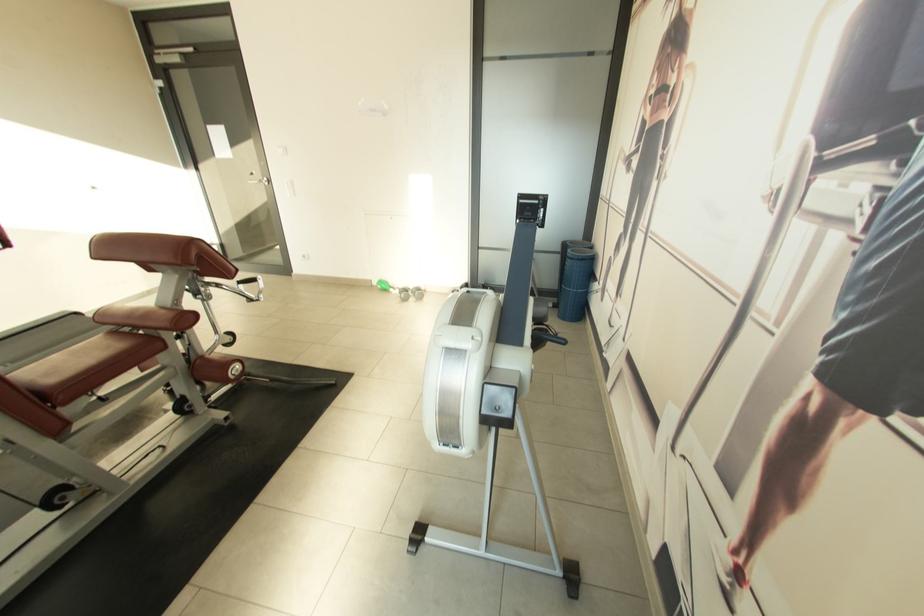
The height and width of the screenshot is (616, 924). What do you see at coordinates (156, 251) in the screenshot? I see `the padded chest support` at bounding box center [156, 251].